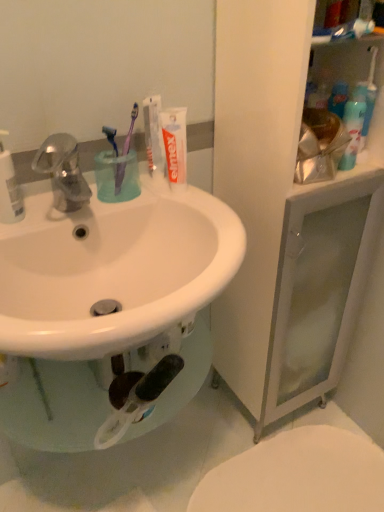
Locate an element on the screen. This screenshot has height=512, width=384. vacant area that is in front of white matte toothpaste at upper center, positioned as the second toothpaste in right-to-left order is located at coordinates (165, 198).